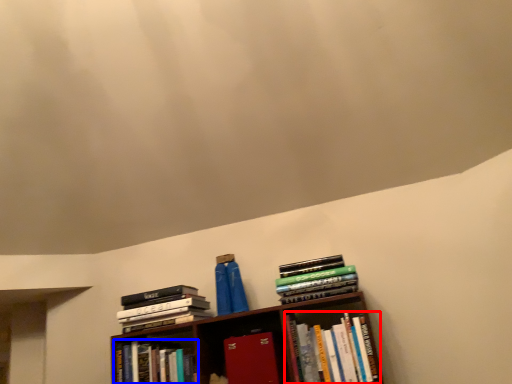
Question: Among these objects, which one is nearest to the camera, book (highlighted by a red box) or book (highlighted by a blue box)?

Choices:
 (A) book
 (B) book

Answer: (A)